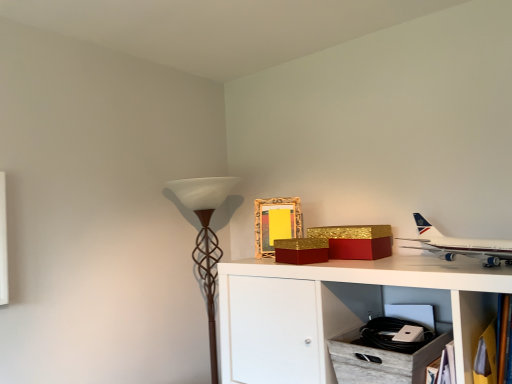
Question: From the image's perspective, is gold textured box at upper center, which is the 1th box from right to left, located above or below brown textured floor lamp at left?

Choices:
 (A) below
 (B) above

Answer: (B)

Question: Does point (372, 226) appear closer or farther from the camera than point (197, 183)?

Choices:
 (A) closer
 (B) farther

Answer: (A)

Question: Considering the real-world distances, which object is farthest from the wooden bookshelf at lower right?

Choices:
 (A) white glossy airplane at upper right
 (B) brown textured floor lamp at left
 (C) gold textured box at upper center, which is the 1th box from right to left
 (D) gold glittery box at upper center, which ranks as the 1th box in left-to-right order
 (E) gold textured picture frame at upper center

Answer: (B)

Question: Estimate the real-world distances between objects in this image. Which object is farther from the gold textured box at upper center, which is the 1th box from right to left?

Choices:
 (A) gold textured picture frame at upper center
 (B) wooden bookshelf at lower right
 (C) white glossy airplane at upper right
 (D) gold glittery box at upper center, which ranks as the 1th box in left-to-right order
 (E) brown textured floor lamp at left

Answer: (E)